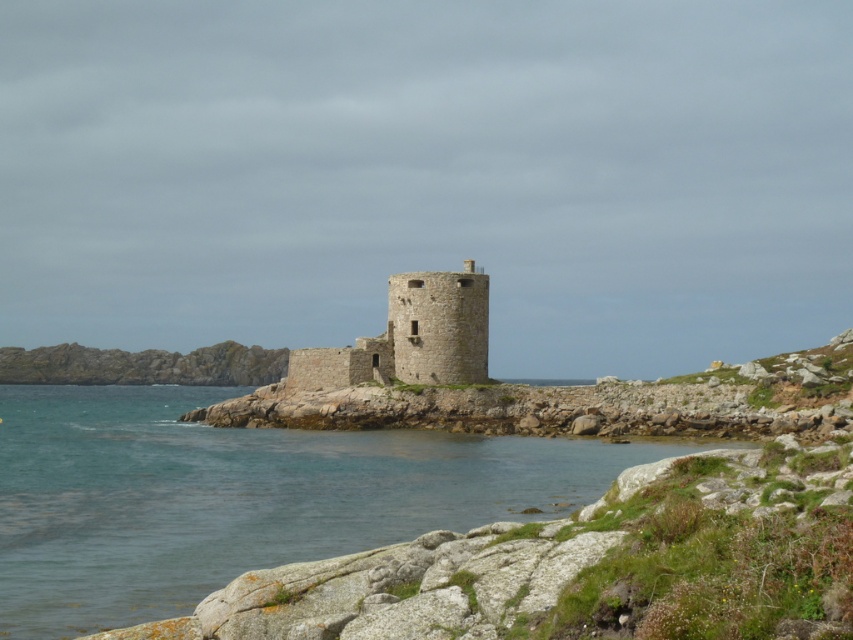
You are standing on the rocky outcrop near the historic stone tower and want to reach the clear water at lower left. If your maximum comfortable walking distance is 40 meters, can you comfortably reach it without feeling strained?

The clear water at lower left is 40.10 meters away from the viewer. Since your maximum comfortable walking distance is 40 meters, you would feel slightly strained to reach it as the distance is just over your limit.

You are a photographer planning to capture the stone tower at center and the clear water at lower left in a single frame. Based on their sizes, which object should you focus on first to ensure both fit well in the composition?

The clear water at lower left is larger in size than the stone tower at center, so you should focus on the clear water at lower left first to ensure both fit well in the composition.

You are a hiker who wants to cross from the rocks to the stone tower at center. You see clear water at lower left between you and the tower. Is the water in your way? Explain.

The clear water at lower left is closer to the viewer than the stone tower at center, so the water is between you and the tower. You must navigate around or through the water to reach the tower.